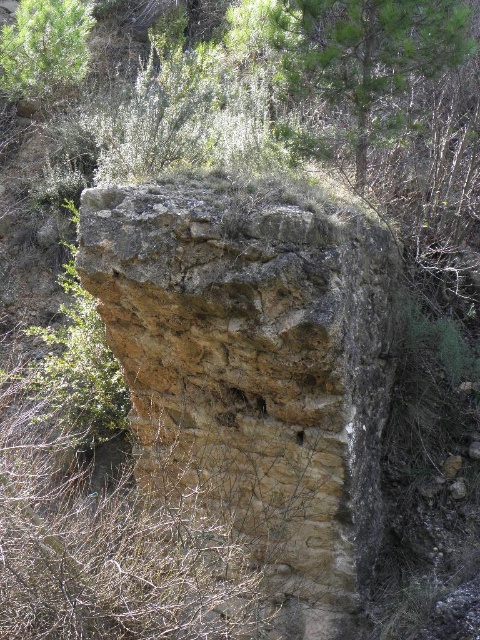
You are a hiker standing at the base of the ancient stone structure. You notice the brown rough stone at center and the green leafy tree at upper center. Which object is closer to you?

The brown rough stone at center is closer to you because it is in front of the green leafy tree at upper center.

You are an archaeologist examining the ancient stone structure. You notice the brown rough stone at center and the green leafy tree at upper left. From your vantage point, which object is closer to you?

The brown rough stone at center is closer to you because it is in front of the green leafy tree at upper left.